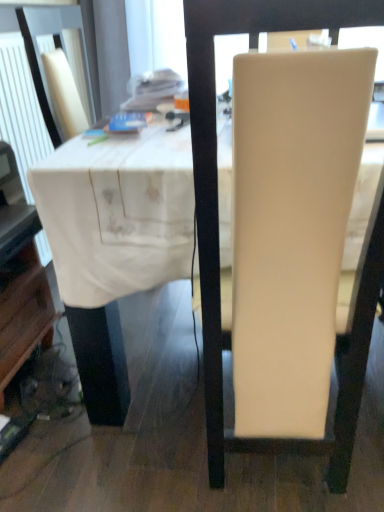
Question: Is beige leather chair at center to the left or to the right of white fabric table at center in the image?

Choices:
 (A) right
 (B) left

Answer: (B)

Question: Considering the positions of beige leather chair at center and white fabric table at center in the image, is beige leather chair at center bigger or smaller than white fabric table at center?

Choices:
 (A) big
 (B) small

Answer: (B)

Question: From the image's perspective, is beige leather chair at center located above or below white fabric table at center?

Choices:
 (A) above
 (B) below

Answer: (B)

Question: Considering the positions of white fabric table at center and beige leather chair at center in the image, is white fabric table at center wider or thinner than beige leather chair at center?

Choices:
 (A) wide
 (B) thin

Answer: (A)

Question: In the image, is white fabric table at center on the left side or the right side of beige leather chair at center?

Choices:
 (A) left
 (B) right

Answer: (B)

Question: From a real-world perspective, is white fabric table at center above or below beige leather chair at center?

Choices:
 (A) below
 (B) above

Answer: (A)

Question: Is point (110, 257) closer or farther from the camera than point (370, 249)?

Choices:
 (A) farther
 (B) closer

Answer: (A)